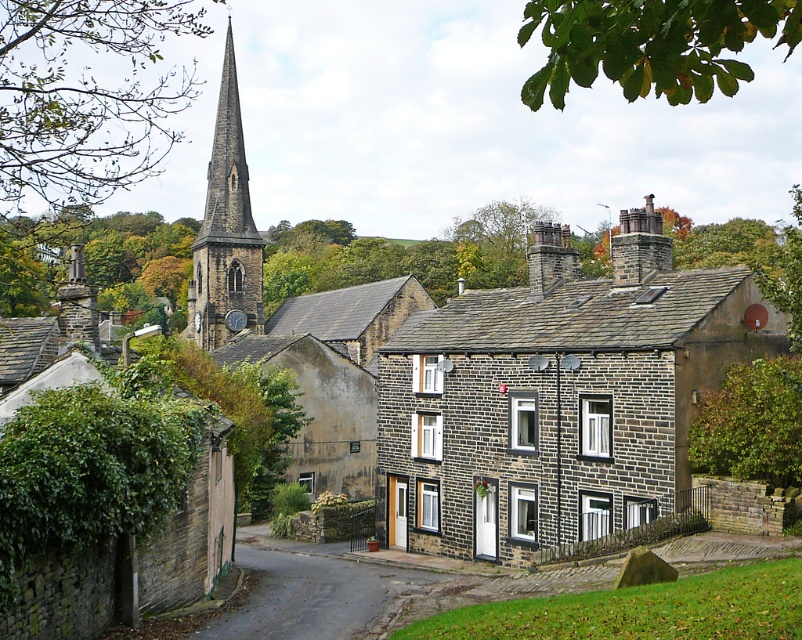
Consider the image. You are standing in the village scene and want to take a photo of the green leafy tree at upper left using a camera that has a maximum zoom range of 20 meters. Can you capture the tree without moving closer?

The green leafy tree at upper left and camera are 33.66 meters apart from each other, which exceeds the camera maximum zoom range of 20 meters. You need to move closer to capture the tree.

You are a tourist in the village and want to take a photo of both the green leafy tree at upper left and the stone statue at upper left. From which side of the statue should you stand to ensure both are in the frame?

The green leafy tree at upper left is positioned on the left side of the stone statue at upper left. Therefore, to capture both in the frame, you should stand to the left of the stone statue at upper left so that the tree is visible to its left side.

Based on the photo, you are a tourist standing in the village square, looking towards the church. You notice a green leafy tree at upper left and a stone statue at upper left. If you want to take a photo that includes both of them in the frame, will you need to zoom out your camera lens?

The green leafy tree at upper left and the stone statue at upper left are 112.19 meters apart from each other. Since they are quite far apart, you will need to zoom out your camera lens to capture both in the same frame.